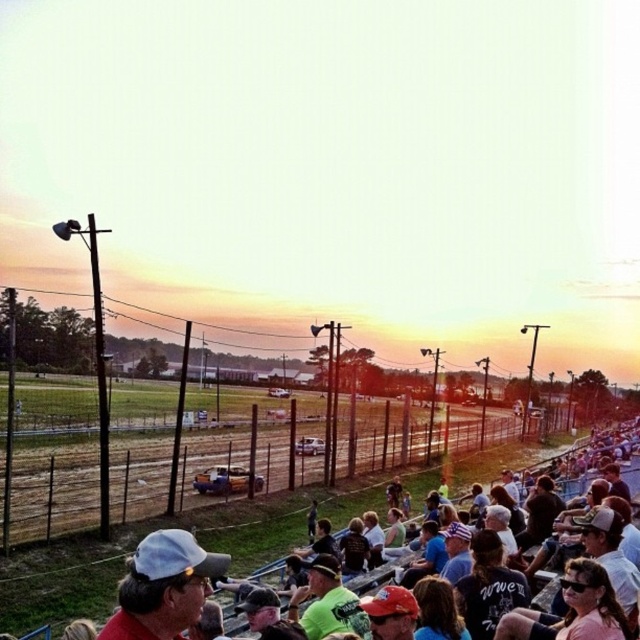
Question: Which object appears closest to the camera in this image?

Choices:
 (A) dark brown hair at lower center
 (B) matte blue shirt at center
 (C) white matte baseball cap at lower left
 (D) green matte t-shirt at center

Answer: (C)

Question: Estimate the real-world distances between objects in this image. Which object is farther from the dark gray shirt at center?

Choices:
 (A) white cotton cap at center
 (B) white cotton shirt at lower center
 (C) green t-shirt at center

Answer: (A)

Question: Can you confirm if white matte baseball cap at lower left is smaller than matte blue shirt at center?

Choices:
 (A) no
 (B) yes

Answer: (B)

Question: Which point is closer to the camera taking this photo?

Choices:
 (A) (387, 518)
 (B) (168, 636)

Answer: (B)

Question: Can you confirm if dark brown hair at lower center is bigger than matte black cap at center?

Choices:
 (A) yes
 (B) no

Answer: (B)

Question: Is dark blue jersey at center behind matte black cap at center?

Choices:
 (A) no
 (B) yes

Answer: (A)